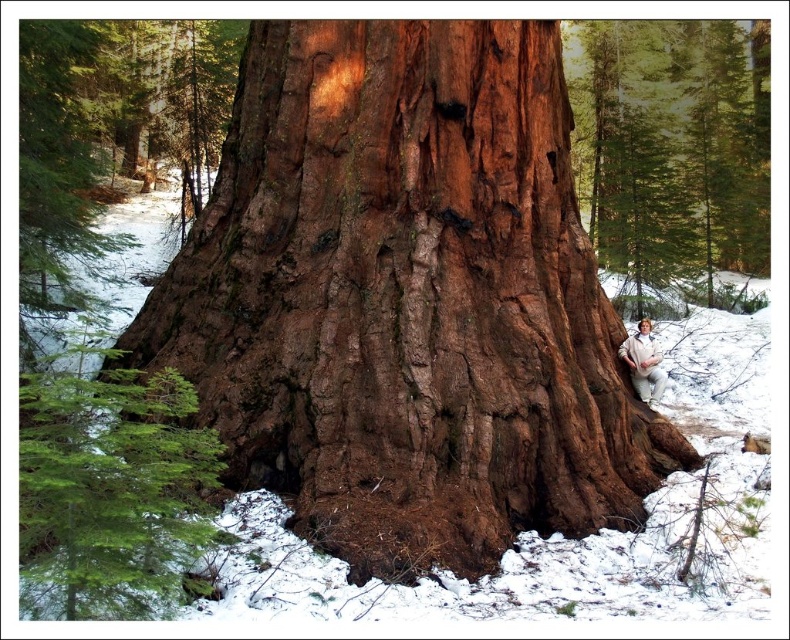
In the scene shown: Does brown rough bark at center come in front of green matte evergreen branch at left?

No.

Is brown rough bark at center taller than green matte evergreen branch at left?

Correct, brown rough bark at center is much taller as green matte evergreen branch at left.

Where is `brown rough bark at center`? brown rough bark at center is located at coordinates [405, 300].

Consider the image. Can you confirm if brown rough bark at lower right is shorter than white cotton pants at lower right?

Incorrect, brown rough bark at lower right's height does not fall short of white cotton pants at lower right's.

From the picture: Is brown rough bark at lower right to the right of white cotton pants at lower right from the viewer's perspective?

Indeed, brown rough bark at lower right is positioned on the right side of white cotton pants at lower right.

Find the location of `brown rough bark at lower right`. brown rough bark at lower right is located at coordinates (672, 154).

Which is more to the right, brown rough bark at lower right or green matte evergreen branch at left?

From the viewer's perspective, brown rough bark at lower right appears more on the right side.

Does brown rough bark at lower right come behind green matte evergreen branch at left?

Yes, brown rough bark at lower right is further from the viewer.

Who is more distant from viewer, (615, 176) or (47, 484)?

The point (615, 176) is more distant.

The image size is (790, 640). Find the location of `brown rough bark at lower right`. brown rough bark at lower right is located at coordinates (672, 154).